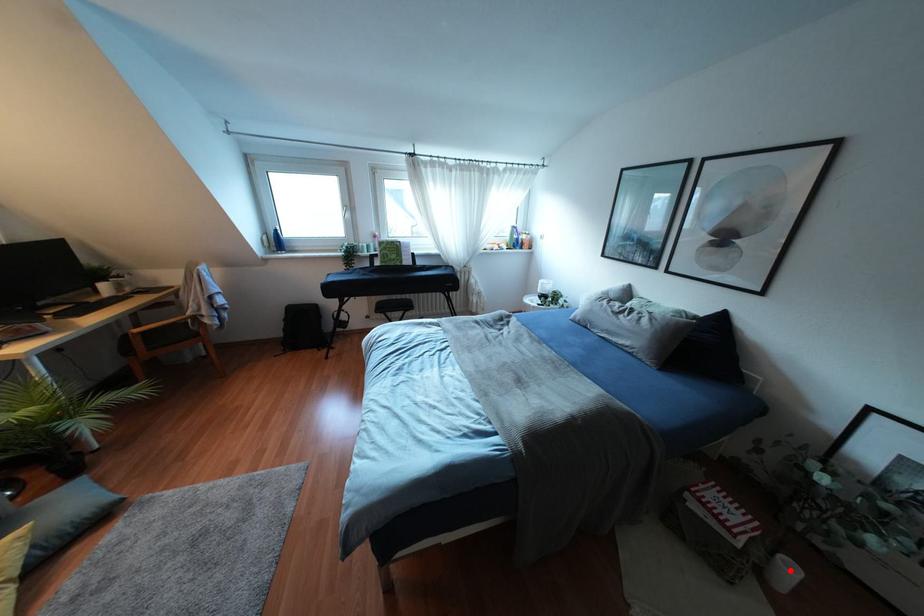
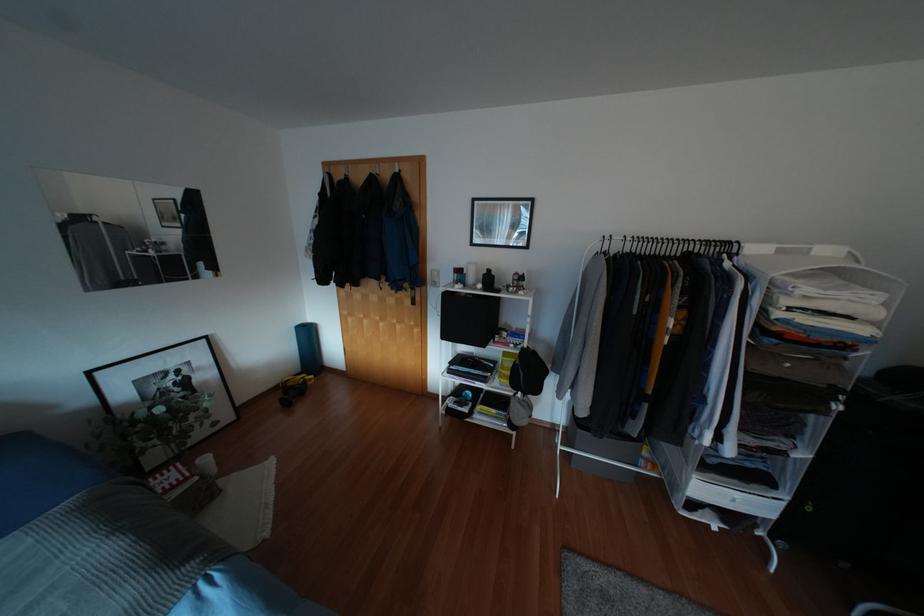
Question: I am providing you with two images of the same scene from different viewpoints. Image1 has a red point marked. In image2, the corresponding 3D location appears at what relative position? Reply with the corresponding letter.

Choices:
 (A) Closer
 (B) Farther

Answer: (B)